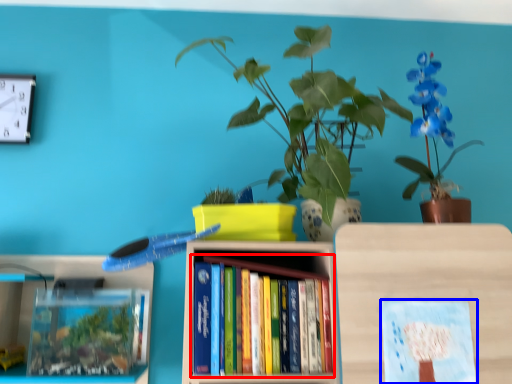
Question: Which of the following is the closest to the observer, book (highlighted by a red box) or book cover (highlighted by a blue box)?

Choices:
 (A) book
 (B) book cover

Answer: (B)